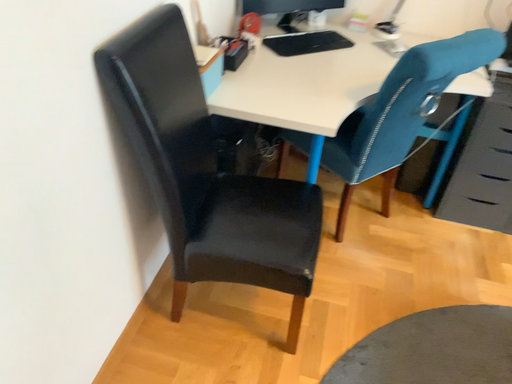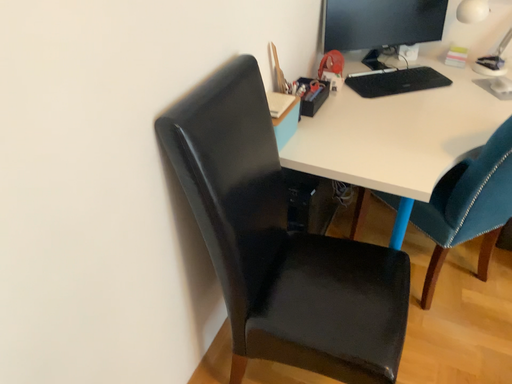
Question: How did the camera likely rotate when shooting the video?

Choices:
 (A) rotated right
 (B) rotated left

Answer: (B)